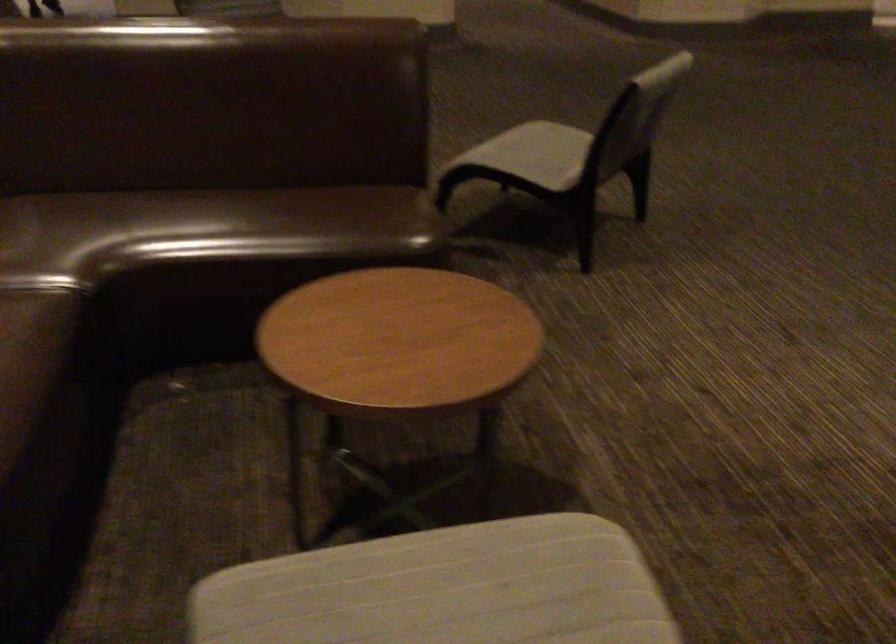
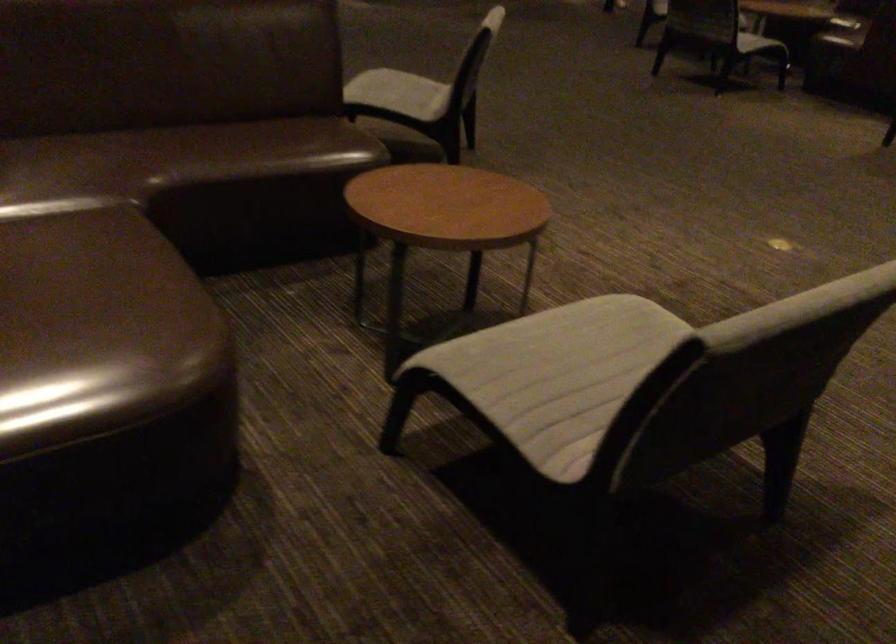
Where in the second image is the point corresponding to point 524,156 from the first image?

(399, 93)